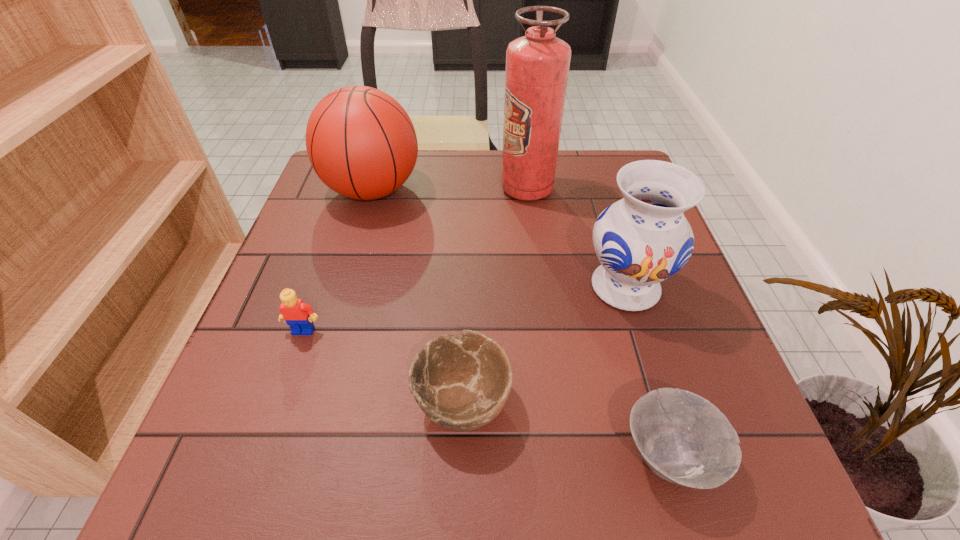
In the image, there is a desktop. Where is `free space at the far right corner`? This screenshot has height=540, width=960. free space at the far right corner is located at coordinates (581, 160).

Find the location of a particular element. The image size is (960, 540). vacant area between the fourth farthest object and the second shortest object is located at coordinates (383, 365).

Where is `vacant point located between the basketball and the shortest object`? The width and height of the screenshot is (960, 540). vacant point located between the basketball and the shortest object is located at coordinates (520, 323).

At what (x,y) coordinates should I click in order to perform the action: click on vacant space that is in between the basketball and the fourth object from right to left. Please return your answer as a coordinate pair (x, y). Looking at the image, I should click on (418, 295).

This screenshot has height=540, width=960. Identify the location of vacant space that's between the shorter bowl and the third object from left to right. [565, 428].

The image size is (960, 540). Find the location of `free space between the Lego and the basketball`. free space between the Lego and the basketball is located at coordinates (338, 260).

Where is `free space between the taller bowl and the fire extinguisher`? Image resolution: width=960 pixels, height=540 pixels. free space between the taller bowl and the fire extinguisher is located at coordinates (494, 294).

Locate an element on the screen. The image size is (960, 540). free space between the basketball and the tallest object is located at coordinates (449, 190).

Where is `empty space that is in between the right bowl and the fourth nearest object`? The height and width of the screenshot is (540, 960). empty space that is in between the right bowl and the fourth nearest object is located at coordinates (647, 372).

You are a GUI agent. You are given a task and a screenshot of the screen. Output one action in this format:
    pyautogui.click(x=<x>, y=<y>)
    Task: Click on the vacant area that lies between the Lego and the third farthest object
    
    Given the screenshot: What is the action you would take?
    pyautogui.click(x=465, y=309)